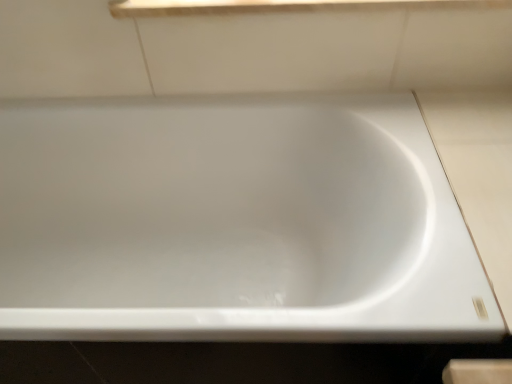
What do you see at coordinates (278, 6) in the screenshot? I see `white glossy window sill at upper center` at bounding box center [278, 6].

Where is `white glossy window sill at upper center`? Image resolution: width=512 pixels, height=384 pixels. white glossy window sill at upper center is located at coordinates (278, 6).

This screenshot has width=512, height=384. Identify the location of white glossy bathtub at center. [x=234, y=224].

What do you see at coordinates (234, 224) in the screenshot? I see `white glossy bathtub at center` at bounding box center [234, 224].

Locate an element on the screen. white glossy window sill at upper center is located at coordinates (278, 6).

Which object is positioned more to the right, white glossy bathtub at center or white glossy window sill at upper center?

From the viewer's perspective, white glossy window sill at upper center appears more on the right side.

Between white glossy bathtub at center and white glossy window sill at upper center, which one is positioned in front?

white glossy bathtub at center is in front.

Does point (319, 305) come closer to viewer compared to point (150, 12)?

No, it is not.

From the image's perspective, who appears lower, white glossy bathtub at center or white glossy window sill at upper center?

white glossy bathtub at center appears lower in the image.

From a real-world perspective, who is located lower, white glossy bathtub at center or white glossy window sill at upper center?

white glossy bathtub at center is physically lower.

Is white glossy bathtub at center wider than white glossy window sill at upper center?

Yes, white glossy bathtub at center is wider than white glossy window sill at upper center.

Is white glossy bathtub at center shorter than white glossy window sill at upper center?

No.

Considering the relative sizes of white glossy bathtub at center and white glossy window sill at upper center in the image provided, is white glossy bathtub at center bigger than white glossy window sill at upper center?

Yes.

Is white glossy bathtub at center located outside white glossy window sill at upper center?

Yes, white glossy bathtub at center is not within white glossy window sill at upper center.

Is white glossy bathtub at center next to white glossy window sill at upper center and touching it?

white glossy bathtub at center is not next to white glossy window sill at upper center, and they're not touching.

Could you tell me if white glossy bathtub at center is turned towards white glossy window sill at upper center?

No, white glossy bathtub at center is not oriented towards white glossy window sill at upper center.

How different are the orientations of white glossy bathtub at center and white glossy window sill at upper center in degrees?

The facing directions of white glossy bathtub at center and white glossy window sill at upper center are 0.077 degrees apart.

The height and width of the screenshot is (384, 512). I want to click on window sill above the white glossy bathtub at center (from a real-world perspective), so click(x=278, y=6).

Considering the relative positions of white glossy window sill at upper center and white glossy bathtub at center in the image provided, is white glossy window sill at upper center to the left of white glossy bathtub at center from the viewer's perspective?

No.

Is white glossy window sill at upper center positioned in front of white glossy bathtub at center?

No.

Is point (369, 6) positioned before point (129, 238)?

Yes.

From the image's perspective, does white glossy window sill at upper center appear lower than white glossy bathtub at center?

Actually, white glossy window sill at upper center appears above white glossy bathtub at center in the image.

From a real-world perspective, is white glossy window sill at upper center under white glossy bathtub at center?

Incorrect, from a real-world perspective, white glossy window sill at upper center is higher than white glossy bathtub at center.

Can you confirm if white glossy window sill at upper center is thinner than white glossy bathtub at center?

Yes.

Can you confirm if white glossy window sill at upper center is taller than white glossy bathtub at center?

Incorrect, the height of white glossy window sill at upper center is not larger of that of white glossy bathtub at center.

Can you confirm if white glossy window sill at upper center is bigger than white glossy bathtub at center?

No.

Is white glossy window sill at upper center not inside white glossy bathtub at center?

Yes, white glossy window sill at upper center is located beyond the bounds of white glossy bathtub at center.

Are white glossy window sill at upper center and white glossy bathtub at center beside each other?

No, white glossy window sill at upper center is not next to white glossy bathtub at center.

From the picture: Is white glossy window sill at upper center looking in the opposite direction of white glossy bathtub at center?

No, white glossy window sill at upper center is not facing away from white glossy bathtub at center.

How different are the orientations of white glossy window sill at upper center and white glossy bathtub at center in degrees?

They differ by 0.077 degrees in their facing directions.

Measure the distance between white glossy window sill at upper center and white glossy bathtub at center.

white glossy window sill at upper center is 21.15 inches away from white glossy bathtub at center.

In the image, there is a white glossy bathtub at center. Where is `window sill above it (from the image's perspective)`? This screenshot has height=384, width=512. window sill above it (from the image's perspective) is located at coordinates (278, 6).

This screenshot has height=384, width=512. What are the coordinates of `bathtub on the left of white glossy window sill at upper center` in the screenshot? It's located at (234, 224).

Locate an element on the screen. This screenshot has width=512, height=384. window sill behind the white glossy bathtub at center is located at coordinates (278, 6).